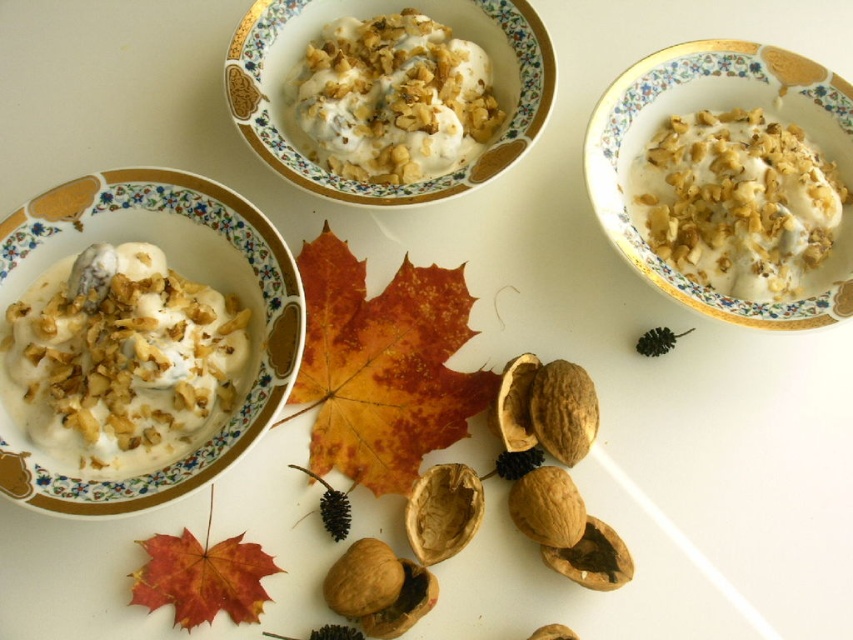
Question: Among these points, which one is farthest from the camera?

Choices:
 (A) (444, 92)
 (B) (840, 214)
 (C) (207, 467)
 (D) (196, 557)

Answer: (A)

Question: Can you confirm if orange matte leaf at center is positioned below white creamy ice cream with crunchy nuts at center?

Choices:
 (A) no
 (B) yes

Answer: (B)

Question: Which point is farther to the camera?

Choices:
 (A) white creamy ice cream with crunchy nuts at center
 (B) white creamy cereal at center

Answer: (A)

Question: Does matte white bowl at left appear over orange matte maple leaf at lower left?

Choices:
 (A) no
 (B) yes

Answer: (B)

Question: Which point is farther to the camera?

Choices:
 (A) matte white bowl at left
 (B) orange matte leaf at center

Answer: (B)

Question: Is white creamy cereal at center to the left of orange matte maple leaf at lower left from the viewer's perspective?

Choices:
 (A) yes
 (B) no

Answer: (B)